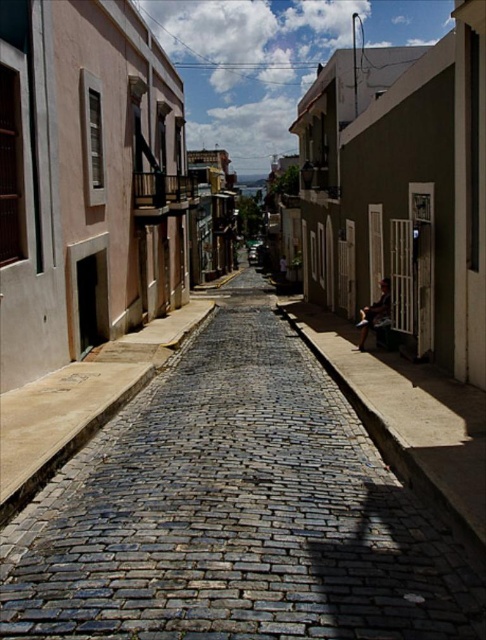
Is point (108, 580) closer to camera compared to point (394, 451)?

Yes, point (108, 580) is closer to viewer.

What do you see at coordinates (235, 512) in the screenshot? I see `cobblestone street at center` at bounding box center [235, 512].

Where is `cobblestone street at center`? The width and height of the screenshot is (486, 640). cobblestone street at center is located at coordinates (235, 512).